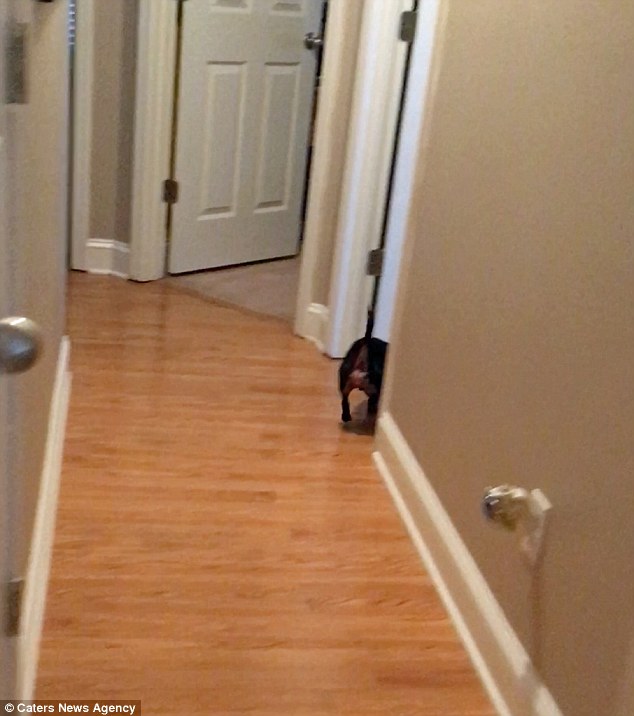
You are a GUI agent. You are given a task and a screenshot of the screen. Output one action in this format:
    pyautogui.click(x=<x>, y=<y>)
    Task: Click on the carpet
    The height and width of the screenshot is (716, 634).
    Given the screenshot: What is the action you would take?
    pyautogui.click(x=262, y=286)